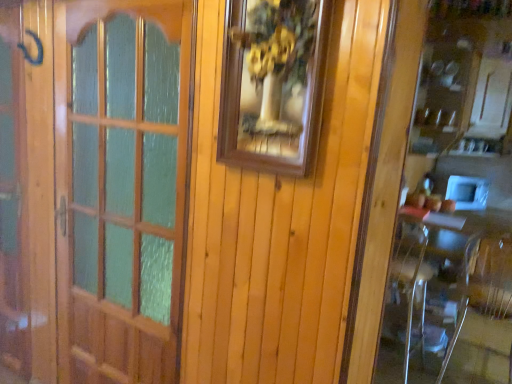
This screenshot has height=384, width=512. Find the location of `white glossy microwave at right`. white glossy microwave at right is located at coordinates (467, 192).

Describe the element at coordinates (467, 192) in the screenshot. I see `white glossy microwave at right` at that location.

What is the approximate height of white glossy microwave at right?

11.42 inches.

The height and width of the screenshot is (384, 512). Identify the location of white glossy microwave at right. (467, 192).